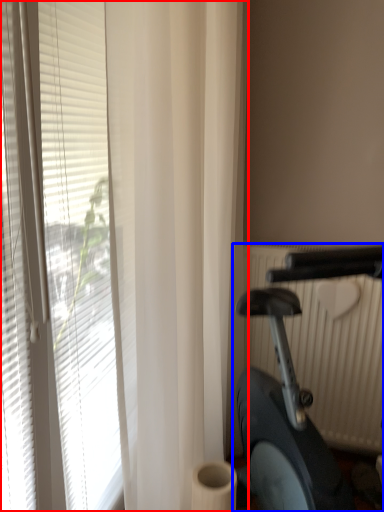
Question: Which object appears closest to the camera in this image, window blind (highlighted by a red box) or stationary bicycle (highlighted by a blue box)?

Choices:
 (A) window blind
 (B) stationary bicycle

Answer: (B)